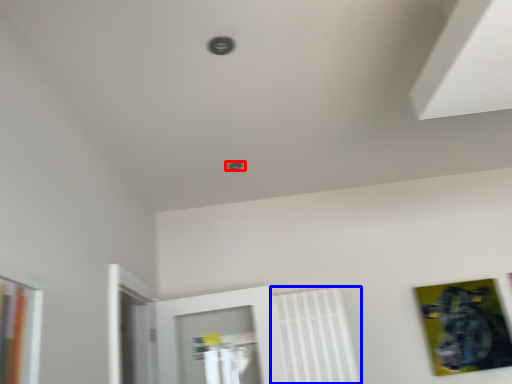
Question: Which point is further to the camera, hole (highlighted by a red box) or radiator (highlighted by a blue box)?

Choices:
 (A) hole
 (B) radiator

Answer: (B)